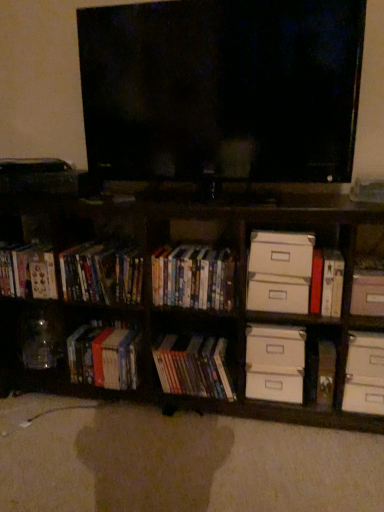
This screenshot has height=512, width=384. I want to click on free point above hardcover books at center, arranged as the first book when viewed from the right (from a real-world perspective), so click(205, 253).